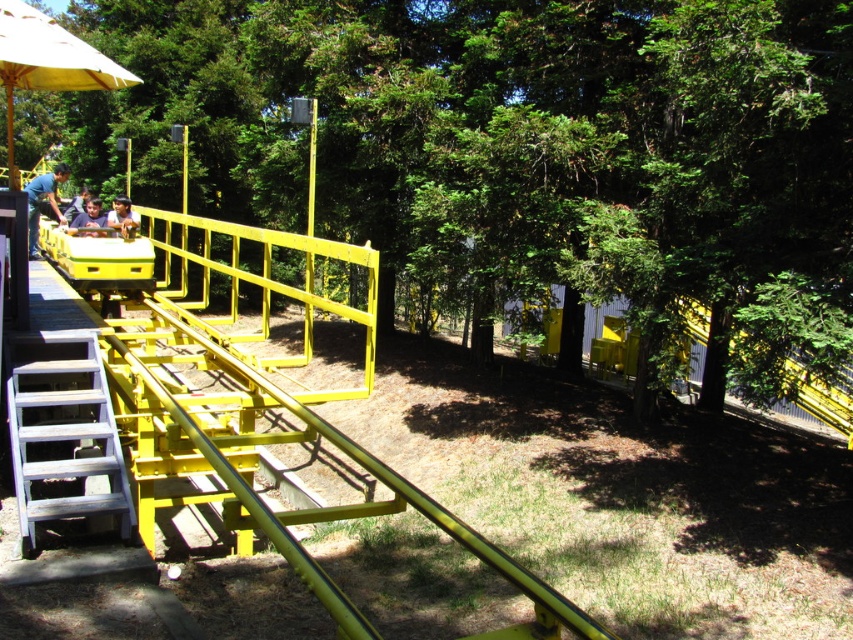
You are a visitor at the amusement park and want to reach the roller coaster cart. You see the wooden stairs at lower left and the matte blue shirt at left. Which object is narrower in width?

The wooden stairs at lower left is thinner than matte blue shirt at left, so the wooden stairs at lower left is narrower in width.

You are a maintenance worker needing to access the yellow roller coaster cart at lower center. You see the wooden stairs at lower left and the matte yellow shirt at left. Which path is wider to walk through?

The wooden stairs at lower left might be wider than matte yellow shirt at left, so the wooden stairs at lower left is the wider path to walk through.

From the picture: You are standing in the amusement park and see the yellow fabric umbrella at upper left and the matte black shirt at left. Which object is higher in the image?

The yellow fabric umbrella at upper left is above the matte black shirt at left, so it is higher in the image.